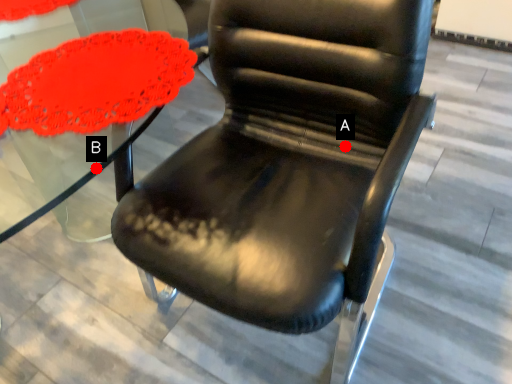
Question: Two points are circled on the image, labeled by A and B beside each circle. Which point is further to the camera?

Choices:
 (A) A is further
 (B) B is further

Answer: (B)